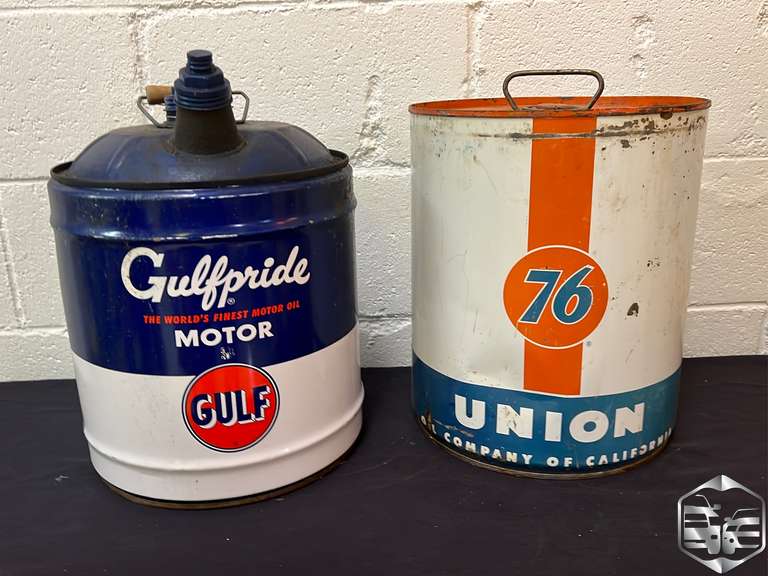
Locate an element on the screen. brick wall in background is located at coordinates (372, 94).